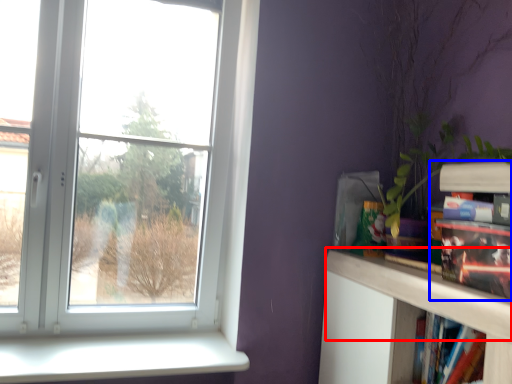
Question: Which object appears farthest to the camera in this image, mantle (highlighted by a red box) or book (highlighted by a blue box)?

Choices:
 (A) mantle
 (B) book

Answer: (B)